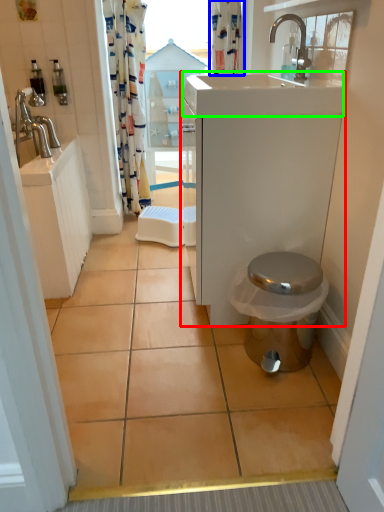
Question: Based on their relative distances, which object is nearer to bathroom cabinet (highlighted by a red box)? Choose from shower curtain (highlighted by a blue box) and counter top (highlighted by a green box).

Choices:
 (A) shower curtain
 (B) counter top

Answer: (B)